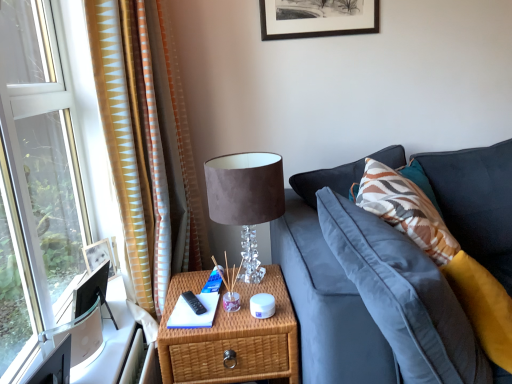
Question: Is velvet lampshade at upper center wider or thinner than woven wood nightstand at center?

Choices:
 (A) thin
 (B) wide

Answer: (A)

Question: In the image, is velvet lampshade at upper center positioned in front of or behind woven wood nightstand at center?

Choices:
 (A) front
 (B) behind

Answer: (B)

Question: Estimate the real-world distances between objects in this image. Which object is closer to the gold-patterned fabric curtain at left?

Choices:
 (A) velvet lampshade at upper center
 (B) woven wood nightstand at center

Answer: (A)

Question: Which is farther from the woven wood nightstand at center?

Choices:
 (A) gold-patterned fabric curtain at left
 (B) velvet lampshade at upper center

Answer: (A)